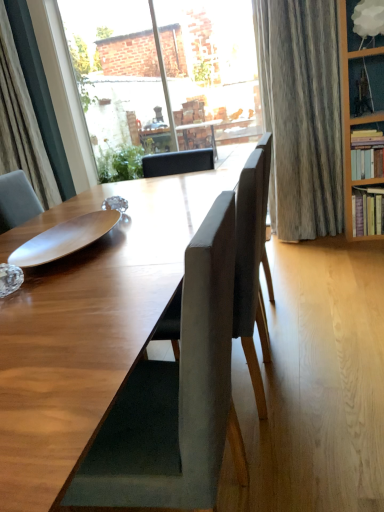
The height and width of the screenshot is (512, 384). I want to click on vacant area located to the right-hand side of suede-like gray chair at center, marked as the 1th chair in a back-to-front arrangement, so click(326, 377).